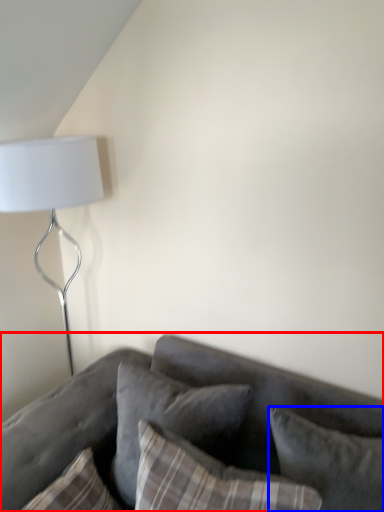
Question: Which of the following is the farthest to the observer, studio couch (highlighted by a red box) or pillow (highlighted by a blue box)?

Choices:
 (A) studio couch
 (B) pillow

Answer: (B)